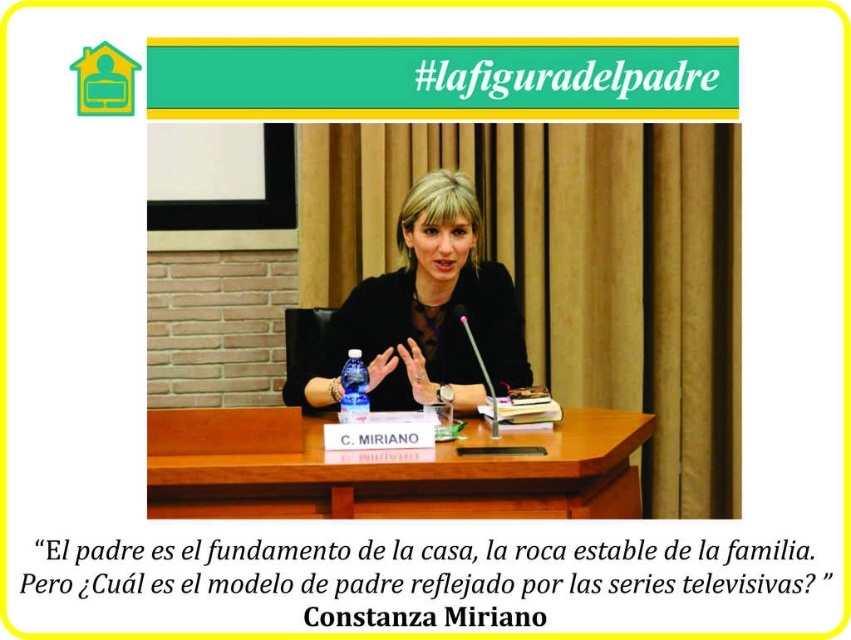
Does point (395, 516) lie behind point (406, 227)?

No.

Consider the image. Who is positioned more to the left, wooden table at center or matte black jacket at center?

wooden table at center is more to the left.

Is point (295, 413) more distant than point (372, 276)?

No.

The image size is (851, 640). Identify the location of wooden table at center. (384, 470).